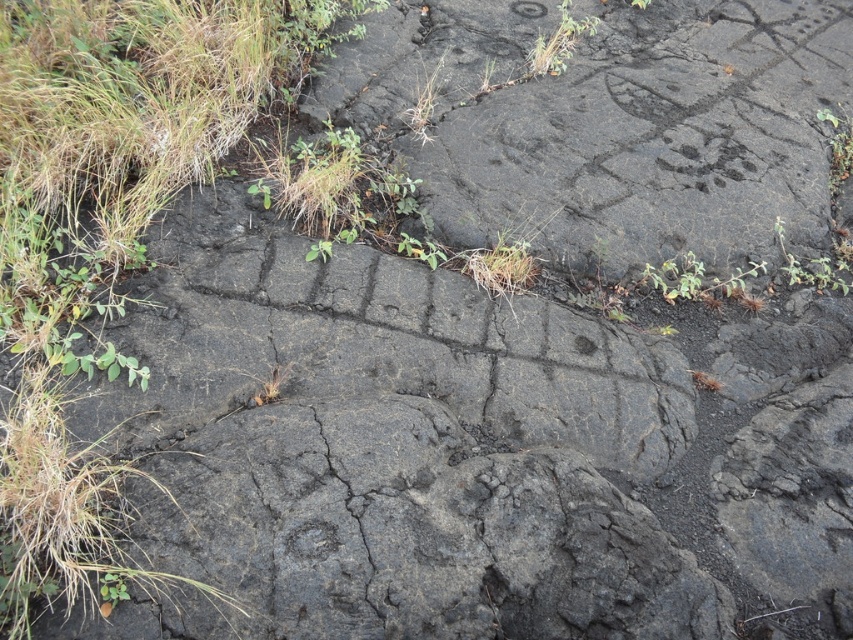
Question: Which object is closer to the camera taking this photo?

Choices:
 (A) green leafy plant at upper right
 (B) green grass at center

Answer: (B)

Question: Which object is farther from the camera taking this photo?

Choices:
 (A) green leafy plant at upper right
 (B) green grass at center

Answer: (A)

Question: Is green leafy plant at upper center to the right of green grass at center from the viewer's perspective?

Choices:
 (A) yes
 (B) no

Answer: (A)

Question: Considering the relative positions of green leafy plant at upper center and green leafy plant at upper right in the image provided, where is green leafy plant at upper center located with respect to green leafy plant at upper right?

Choices:
 (A) right
 (B) left

Answer: (B)

Question: Based on their relative distances, which object is nearer to the green leafy plant at upper center?

Choices:
 (A) green leafy plant at upper right
 (B) green grass at center

Answer: (B)

Question: Is green leafy plant at upper right further to camera compared to green grass at center?

Choices:
 (A) yes
 (B) no

Answer: (A)